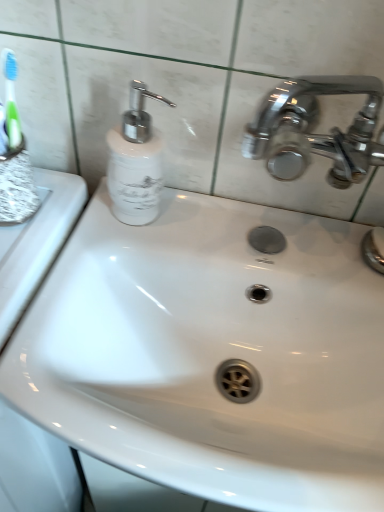
Find the location of `free location to the left of polished chrome faucet at upper right`. free location to the left of polished chrome faucet at upper right is located at coordinates click(x=276, y=232).